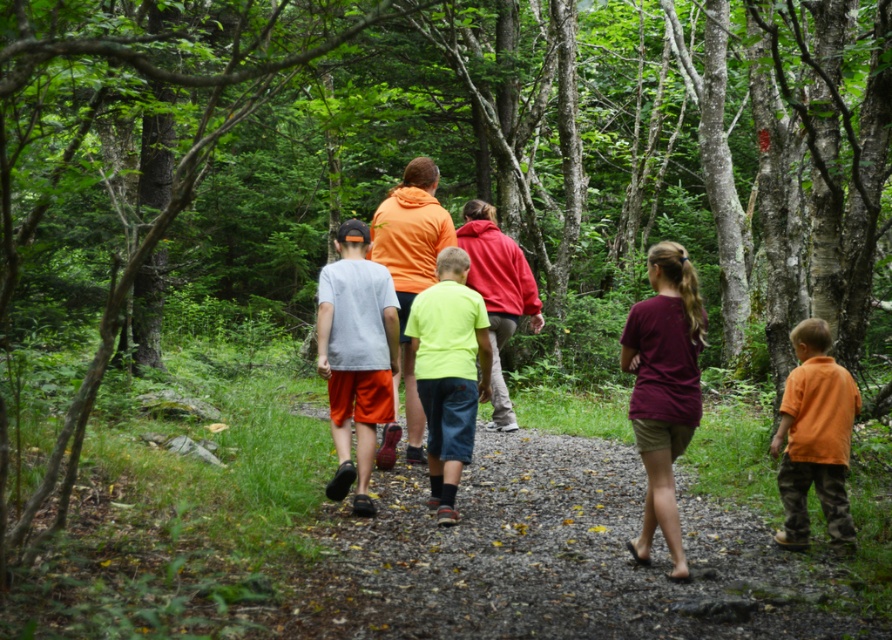
You are a drone operator trying to capture a photo of the orange cotton hoodie at center from above. The drone is currently at a position where it can see the forest trail and the group. To ensure the hoodie is in the photo, where should you aim the camera? Please provide the coordinates in the format of a point like this example format, e.g., point 0.5,0.5.

The orange cotton hoodie at center is located at point [666,388], so you should aim the camera at that coordinate to capture it in the photo.